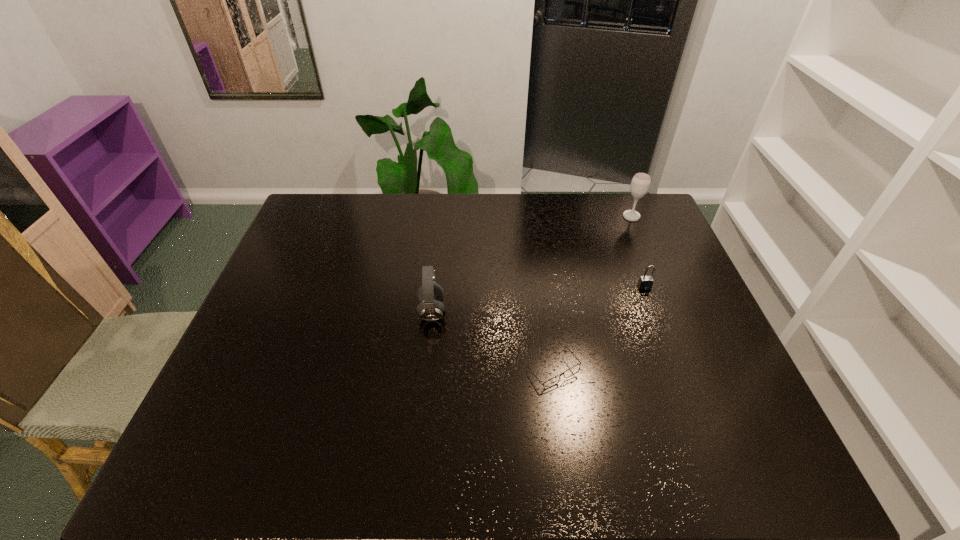
Locate an element on the screen. vacant space situated with the lenses facing outward on the nearest object is located at coordinates (564, 452).

You are a GUI agent. You are given a task and a screenshot of the screen. Output one action in this format:
    pyautogui.click(x=<x>, y=<y>)
    Task: Click on the object located at the far edge
    
    Given the screenshot: What is the action you would take?
    pyautogui.click(x=640, y=184)

This screenshot has height=540, width=960. Find the location of `wineglass that is positioned at the right edge`. wineglass that is positioned at the right edge is located at coordinates (640, 184).

Find the location of a particular element. This screenshot has height=540, width=960. padlock present at the right edge is located at coordinates (645, 282).

Locate an element on the screen. object at the far right corner is located at coordinates (640, 184).

Identify the location of vacant space at the far edge of the desktop. Image resolution: width=960 pixels, height=540 pixels. (383, 219).

Locate an element on the screen. Image resolution: width=960 pixels, height=540 pixels. vacant space at the near edge of the desktop is located at coordinates (320, 468).

The width and height of the screenshot is (960, 540). In the image, there is a desktop. Find the location of `vacant space at the left edge`. vacant space at the left edge is located at coordinates (303, 234).

In the image, there is a desktop. Identify the location of vacant space at the right edge. (695, 299).

Find the location of a particular element. The image size is (960, 540). vacant space at the far left corner is located at coordinates (305, 218).